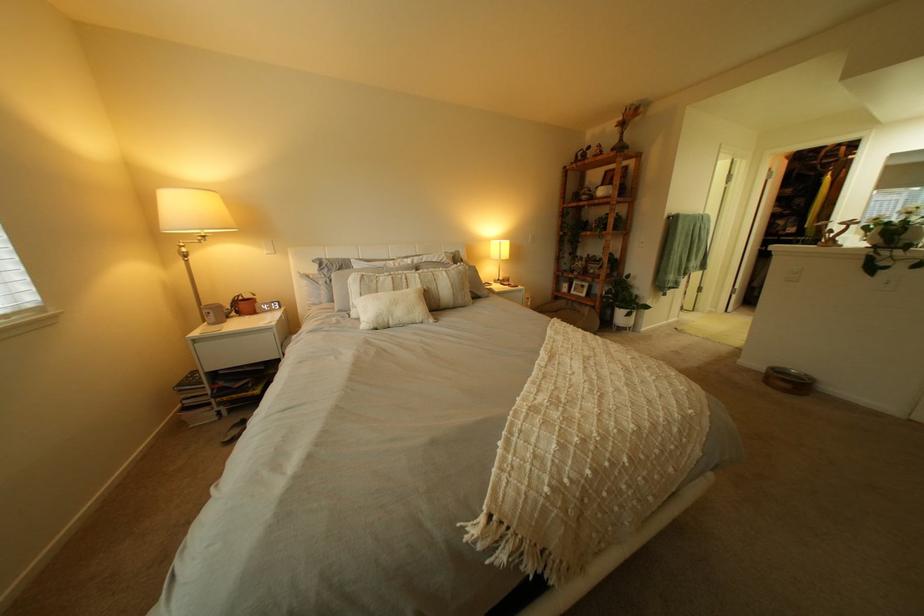
The location [787,379] corresponds to which object?

It refers to a pet food bowl.